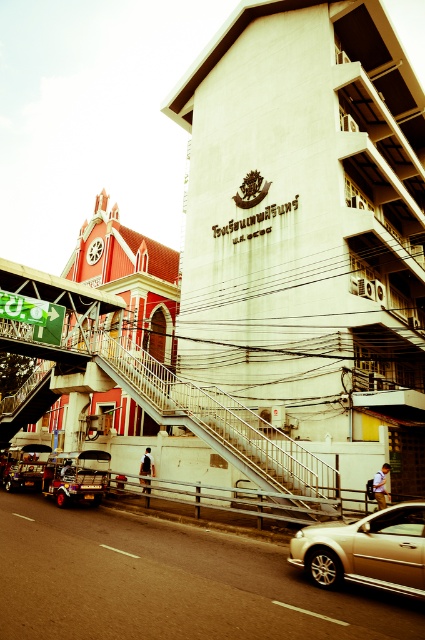
You are standing at the center of the urban street scene. You see a point marked at coordinates (73, 483). What object is located at that point?

The point at coordinates (73, 483) marks the location of the metallic gold tuk tuk at lower left.